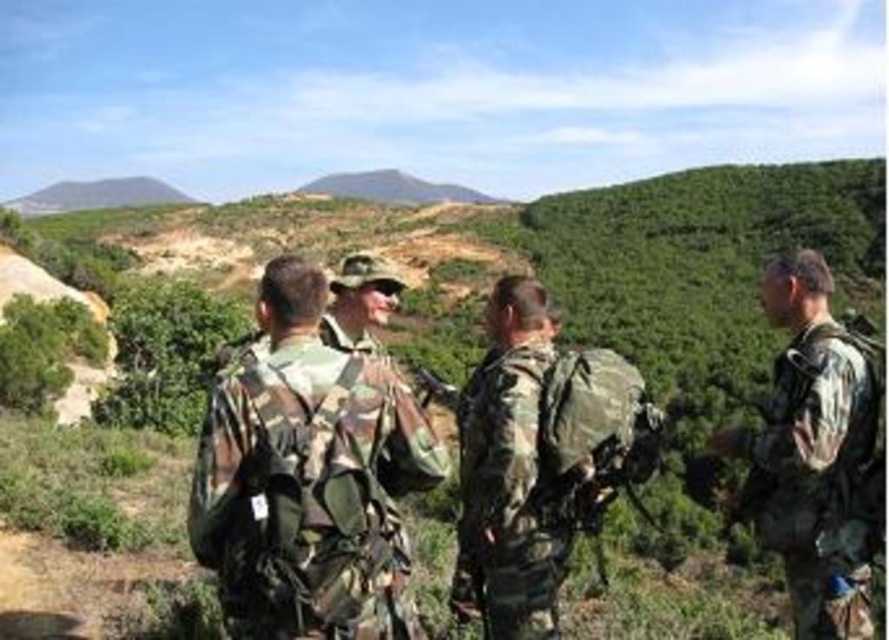
Question: Is camouflage fabric uniform at center thinner than camouflage fabric backpack at center?

Choices:
 (A) yes
 (B) no

Answer: (B)

Question: Which point appears farthest from the camera in this image?

Choices:
 (A) (535, 381)
 (B) (385, 538)
 (C) (859, 384)

Answer: (A)

Question: Which is farther from the camouflage fabric backpack at right?

Choices:
 (A) camouflage fabric uniform at center
 (B) camouflage fabric backpack at center

Answer: (A)

Question: Does camouflage fabric backpack at right appear on the right side of camouflage fabric backpack at center?

Choices:
 (A) yes
 (B) no

Answer: (A)

Question: Which of the following is the closest to the observer?

Choices:
 (A) (519, 570)
 (B) (369, 436)
 (C) (814, 369)

Answer: (B)

Question: Can you confirm if camouflage fabric uniform at center is positioned to the right of camouflage fabric backpack at right?

Choices:
 (A) yes
 (B) no

Answer: (B)